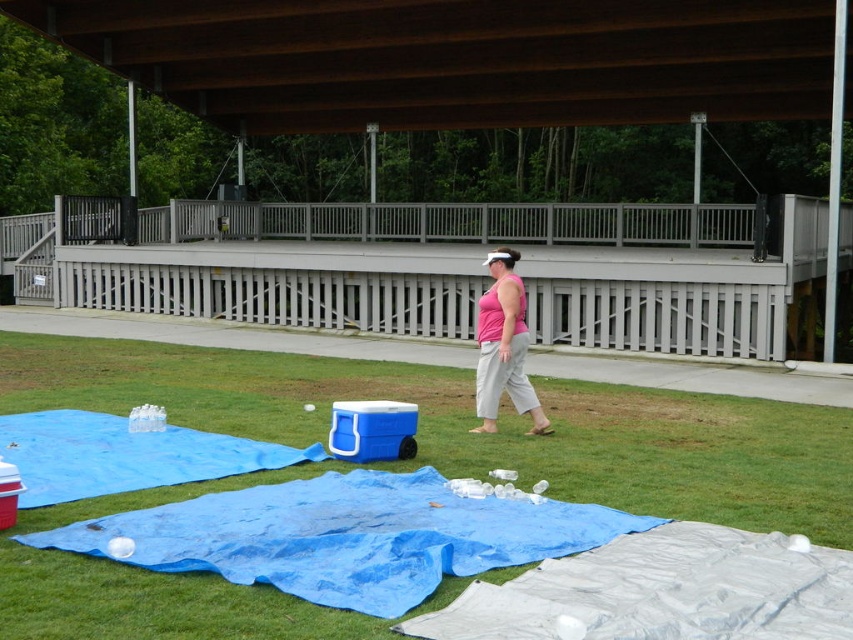
Question: Which point is farther to the camera?

Choices:
 (A) pink matte tank top at center
 (B) green grass at center

Answer: (A)

Question: Is green grass at center closer to the viewer compared to pink matte tank top at center?

Choices:
 (A) yes
 (B) no

Answer: (A)

Question: Which object is farther from the camera taking this photo?

Choices:
 (A) pink matte tank top at center
 (B) green grass at center
 (C) blue tarp at lower center

Answer: (A)

Question: Is green grass at center closer to the viewer compared to blue tarp at lower center?

Choices:
 (A) yes
 (B) no

Answer: (A)

Question: Among these points, which one is nearest to the camera?

Choices:
 (A) (277, 602)
 (B) (502, 330)
 (C) (561, 547)

Answer: (A)

Question: Can you confirm if green grass at center is wider than blue tarp at lower center?

Choices:
 (A) no
 (B) yes

Answer: (B)